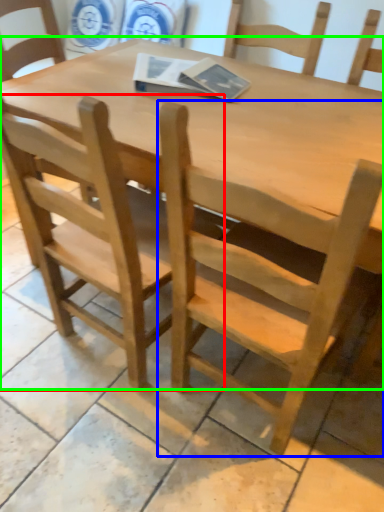
Question: Based on their relative distances, which object is nearer to chair (highlighted by a red box)? Choose from chair (highlighted by a blue box) and table (highlighted by a green box).

Choices:
 (A) chair
 (B) table

Answer: (A)